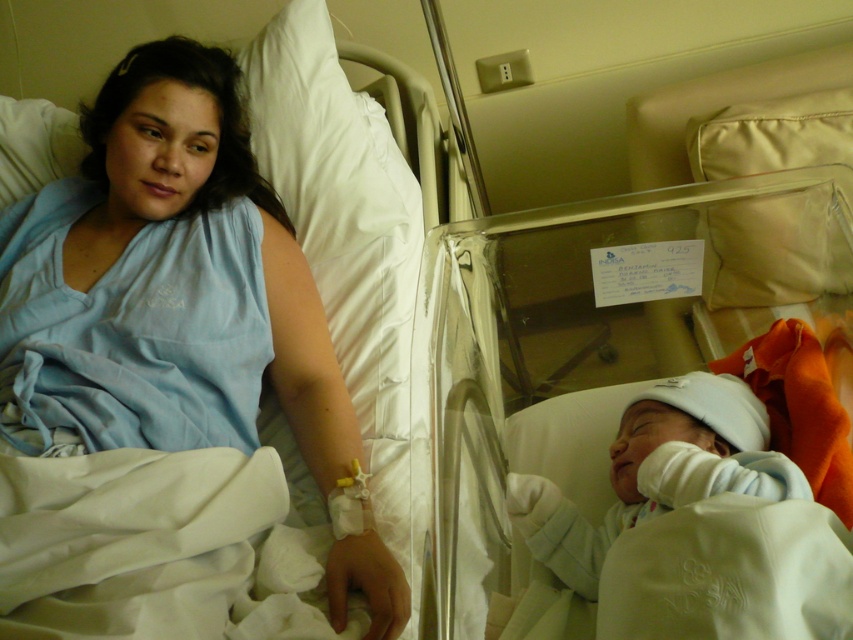
You are a nurse in the hospital. You need to check the blue fabric at upper left located at point (178, 305). Can you reach it without moving the incubator next to the woman?

The blue fabric at upper left is located at point (178, 305), so yes, the nurse can reach it without moving the incubator next to the woman.

You are a nurse entering the room and need to check both the blue fabric at upper left and the white soft newborn at center. Which object should you check first if you want to attend to the closer one first?

You should check the blue fabric at upper left first because it is closer to you than the white soft newborn at center, which is further away.